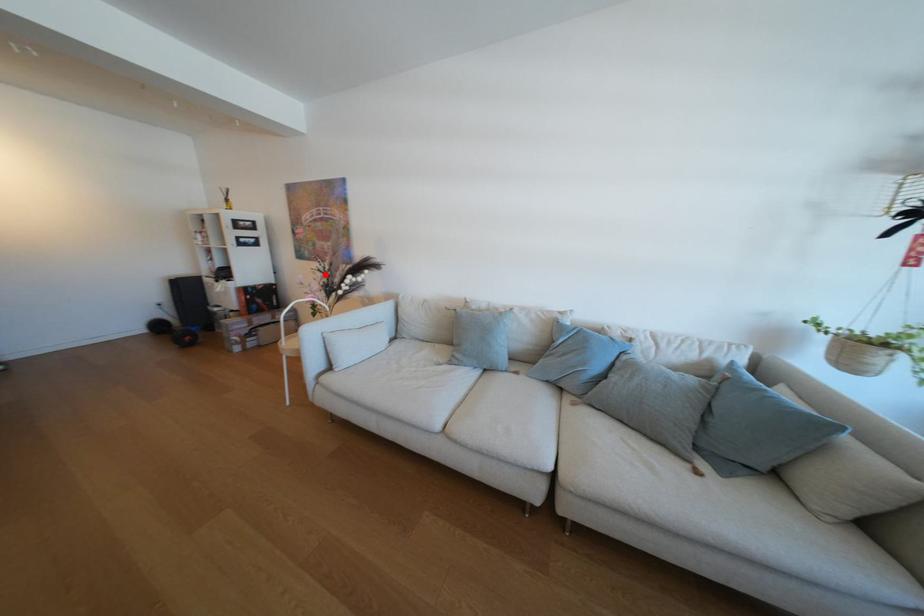
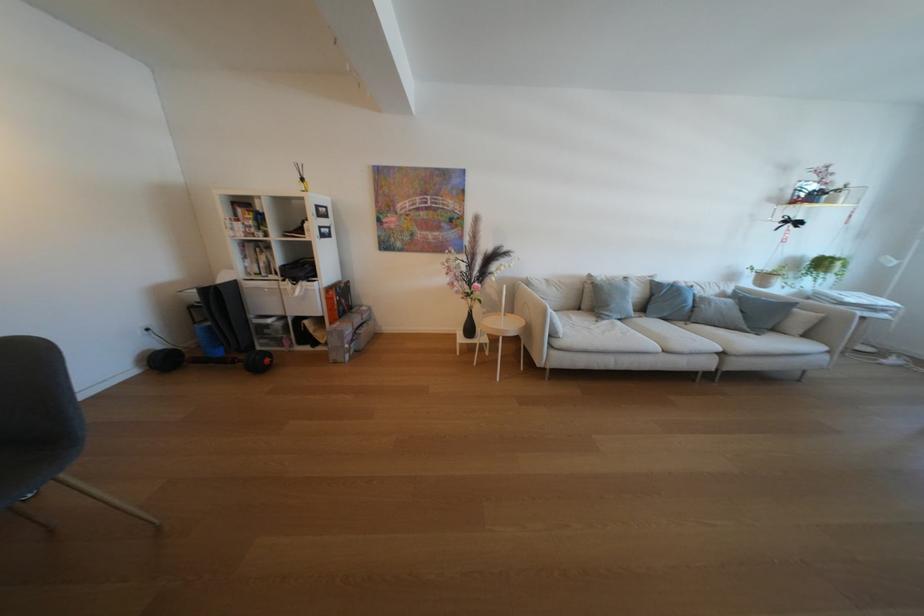
In the second image, find the point that corresponds to the highlighted location in the first image.

(455, 265)